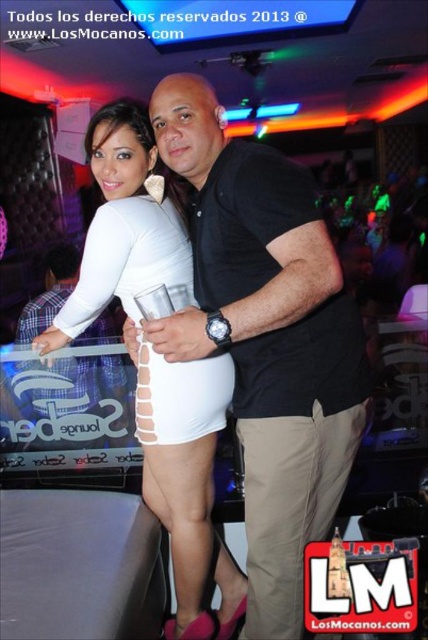
Consider the image. You are a photographer adjusting your camera settings to focus on the black matte shirt at center and the tan cotton pants at center. Which object should you focus on first to ensure both are in sharp focus?

You should focus on the black matte shirt at center first since it is closer to the viewer than the tan cotton pants at center, allowing the pants to fall within the depth of field when focused on the shirt.

You are a photographer at the nightclub and need to adjust the lighting to ensure both the white matte skirt at center and the white matte dress at center are visible. Given their height difference, which one might require more upward lighting to fully capture its details?

The white matte skirt at center is much taller than the white matte dress at center, so it might require more upward lighting to fully capture its details.